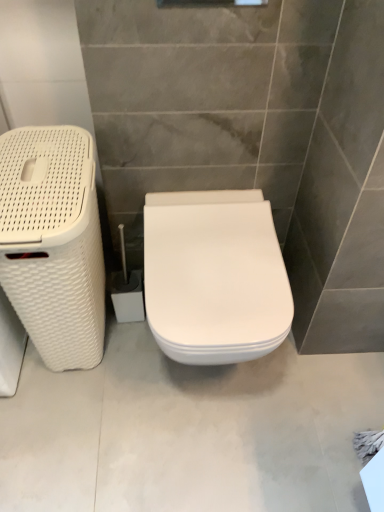
The width and height of the screenshot is (384, 512). In order to click on vacant space in front of white woven laundry basket at left in this screenshot , I will do pyautogui.click(x=78, y=420).